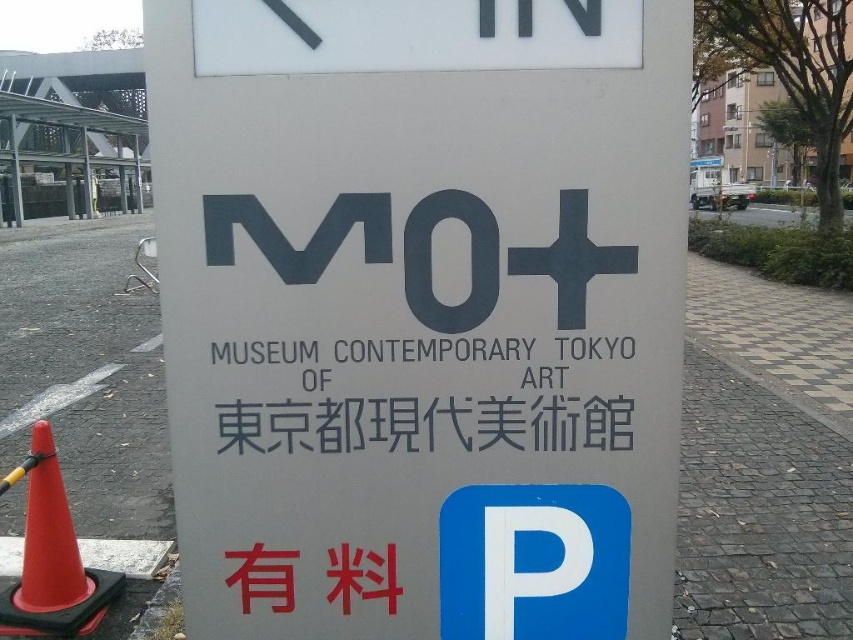
You are standing at the Museum of Contemporary Art Tokyo and want to walk from the red traffic cone to the parking symbol. The red traffic cone is at point (456, 106) and the parking symbol is at point (498, 401). Which point is closer to your starting position?

Point (456, 106) is in front of point (498, 401), so the red traffic cone is closer to your starting position.